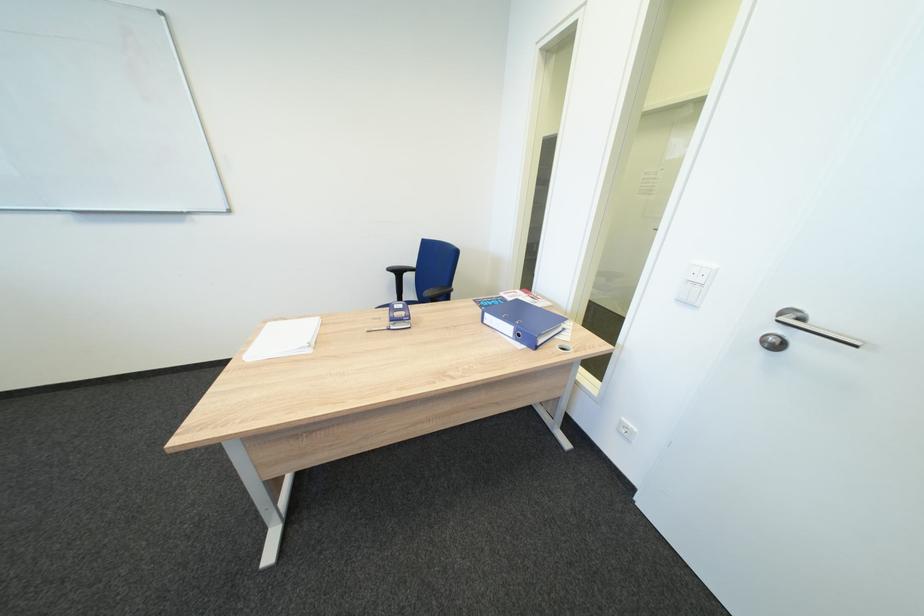
The image size is (924, 616). Describe the element at coordinates (772, 342) in the screenshot. I see `the binder finger hole` at that location.